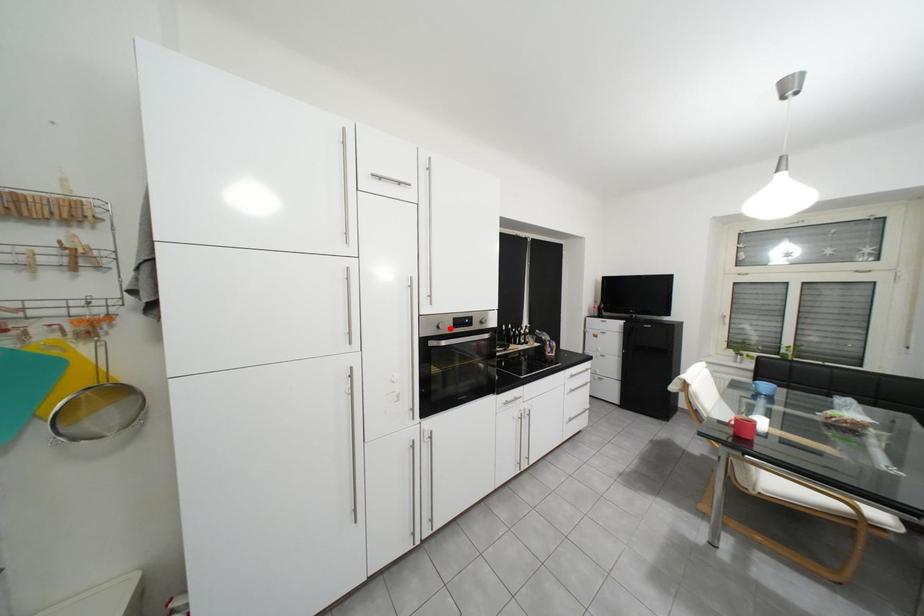
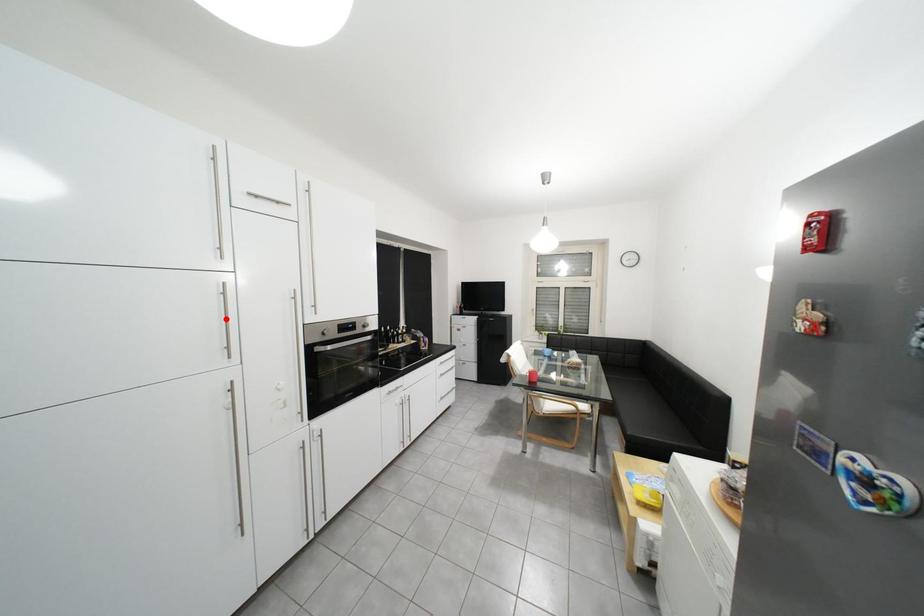
I am providing you with two images of the same scene from different viewpoints. A red point is marked on the first image and another point is marked on the second image. Is the red point in image1 aligned with the point shown in image2?

No